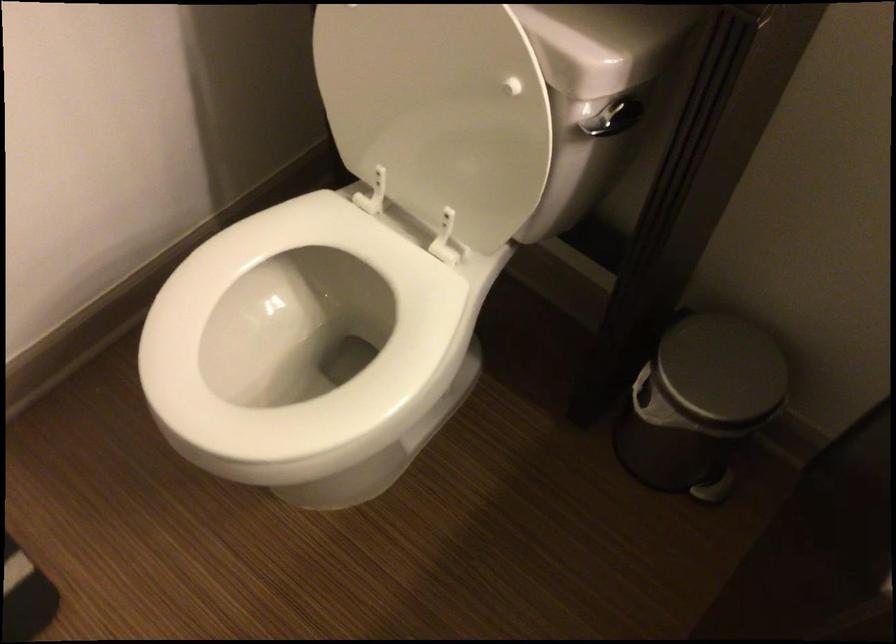
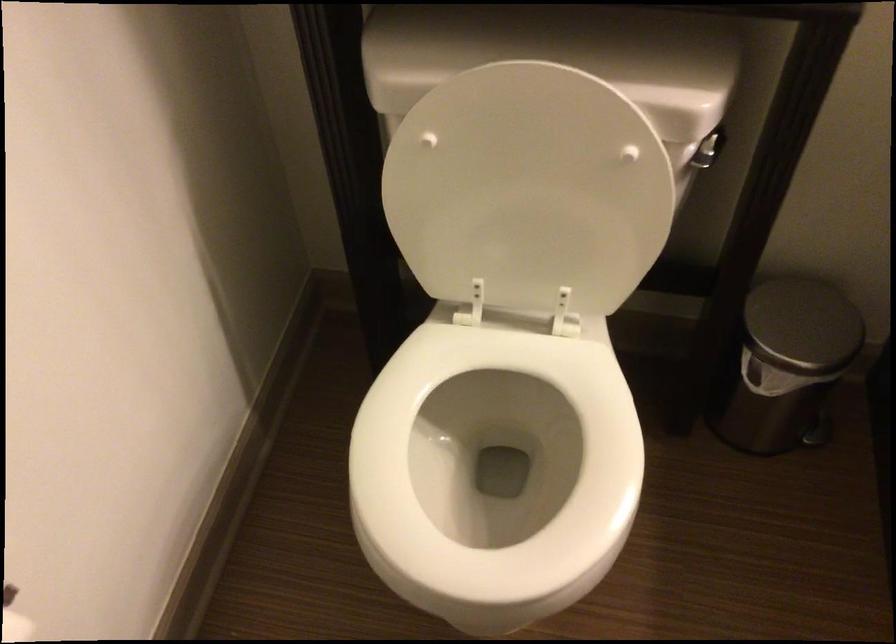
Find the pixel in the second image that matches (352,355) in the first image.

(494, 468)